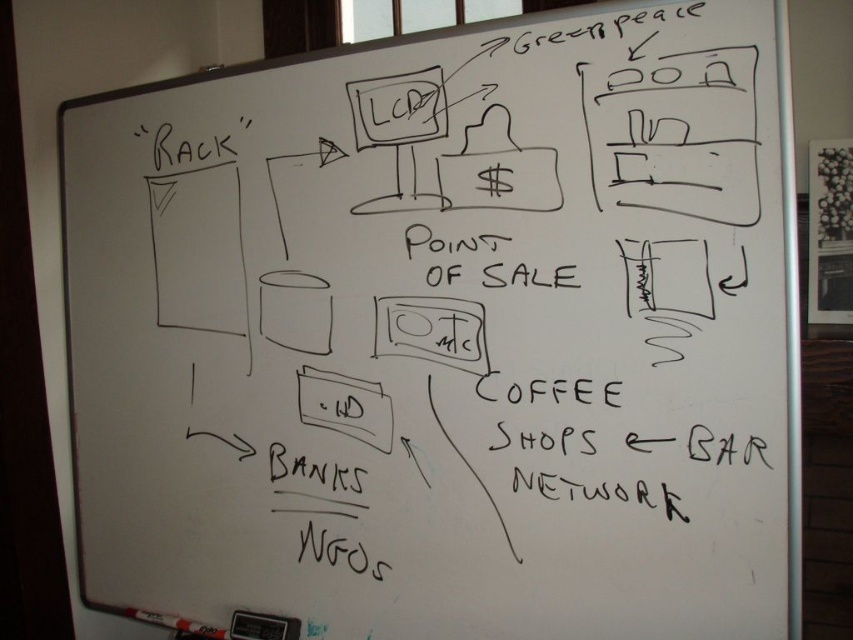
You are a presenter standing at the whiteboard and need to reach both the white paper at center and the white matte marker at bottom left. Which object is closer to you?

The white matte marker at bottom left is closer because the white paper at center is 20.84 inches away from it.

You are a presenter standing at the front of the room and want to pick up the white paper at center on the whiteboard. Can you reach it without moving closer?

The white paper at center is 1.31 meters away from the viewer. Since the average arm length is about 0.7 meters, the presenter cannot reach the white paper at center without moving closer.

You are an assistant organizing the whiteboard. You need to place a new sticky note on the whiteboard. The sticky note must be placed above the white matte marker at bottom left but below the white paper at center. Is this possible?

The white paper at center is positioned over the white matte marker at bottom left, so there is no space between them for placing the sticky note as required.